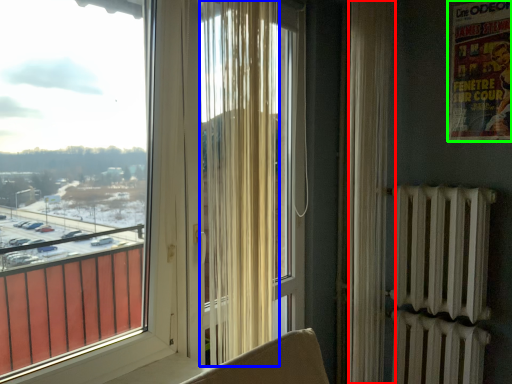
Question: Which object is positioned closest to curtain (highlighted by a red box)? Select from curtain (highlighted by a blue box) and poster page (highlighted by a green box).

Choices:
 (A) curtain
 (B) poster page

Answer: (B)